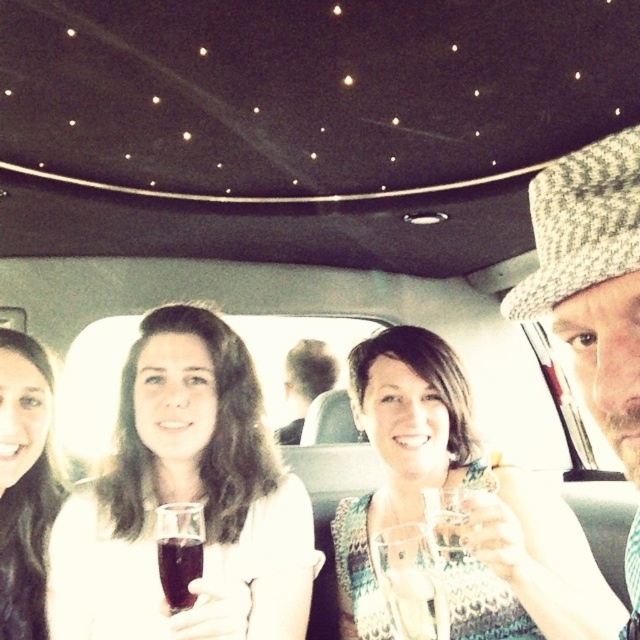
Question: Estimate the real-world distances between objects in this image. Which object is closer to the smooth brown hair at left?

Choices:
 (A) dark purple glass at center
 (B) clear glass wine glass at center
 (C) patterned fabric dress at center

Answer: (A)

Question: Which point is farther to the camera?

Choices:
 (A) (292, 353)
 (B) (3, 358)

Answer: (A)

Question: Does patterned fabric dress at center come in front of light brown hair at center?

Choices:
 (A) no
 (B) yes

Answer: (B)

Question: Does clear glass wine glass at center have a smaller size compared to light brown hair at center?

Choices:
 (A) no
 (B) yes

Answer: (B)

Question: Based on their relative distances, which object is nearer to the light brown hair at center?

Choices:
 (A) dark purple glass at center
 (B) matte white shirt at center

Answer: (B)

Question: Does patterned fabric dress at center have a lesser width compared to dark purple glass at center?

Choices:
 (A) yes
 (B) no

Answer: (B)